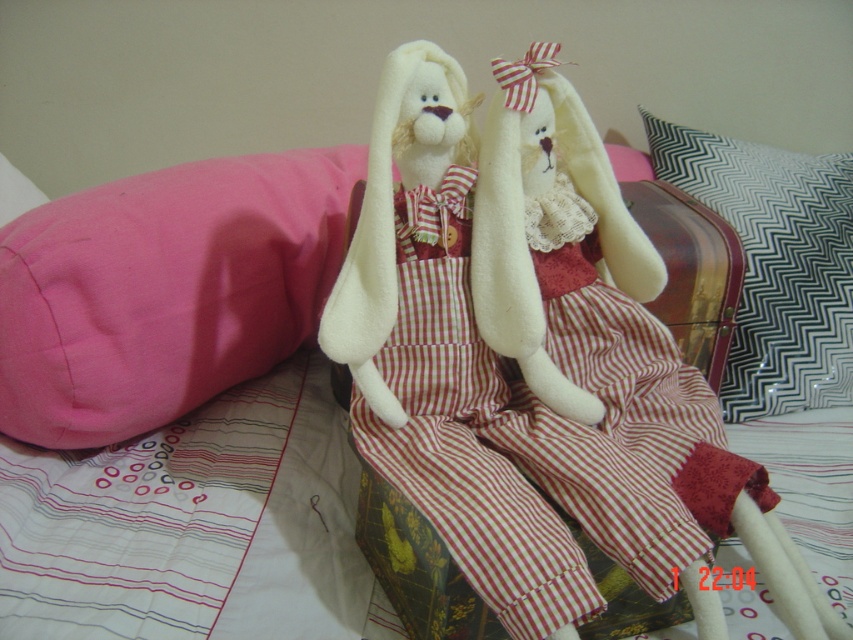
What are the coordinates of the red plaid fabric dress at center?

The red plaid fabric dress at center is located at coordinates point (502, 470).

You are packing a suitcase and need to place the pink fabric pillow at left and the black and white zigzag pillow at upper right. Based on the scene, which pillow should you place first to ensure both fit properly?

The pink fabric pillow at left should be placed first because it is in front of the black and white zigzag pillow at upper right, meaning it occupies the lower position, allowing the other pillow to be placed above it.